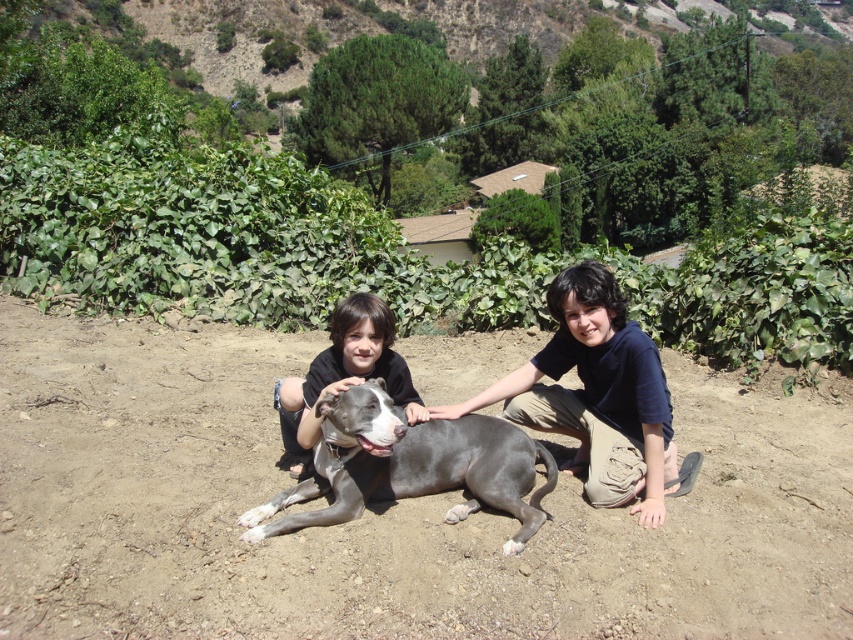
Who is positioned more to the right, smooth gray dog at center or matte black shirt at center?

Positioned to the right is smooth gray dog at center.

Is smooth gray dog at center taller than matte black shirt at center?

Indeed, smooth gray dog at center has a greater height compared to matte black shirt at center.

Who is more forward, (531, 397) or (381, 349)?

Positioned in front is point (381, 349).

I want to click on smooth gray dog at center, so click(x=598, y=396).

Is smooth gray dog at center taller than gray smooth dog at center?

Yes, smooth gray dog at center is taller than gray smooth dog at center.

Does smooth gray dog at center have a greater width compared to gray smooth dog at center?

Indeed, smooth gray dog at center has a greater width compared to gray smooth dog at center.

Who is more forward, (x=699, y=458) or (x=329, y=429)?

Positioned in front is point (x=329, y=429).

This screenshot has width=853, height=640. Identify the location of smooth gray dog at center. (598, 396).

In the scene shown: Between dull brown dirt at center and matte black shirt at center, which one appears on the left side from the viewer's perspective?

From the viewer's perspective, matte black shirt at center appears more on the left side.

Image resolution: width=853 pixels, height=640 pixels. What are the coordinates of `dull brown dirt at center` in the screenshot? It's located at (383, 509).

This screenshot has height=640, width=853. Describe the element at coordinates (383, 509) in the screenshot. I see `dull brown dirt at center` at that location.

I want to click on dull brown dirt at center, so click(x=383, y=509).